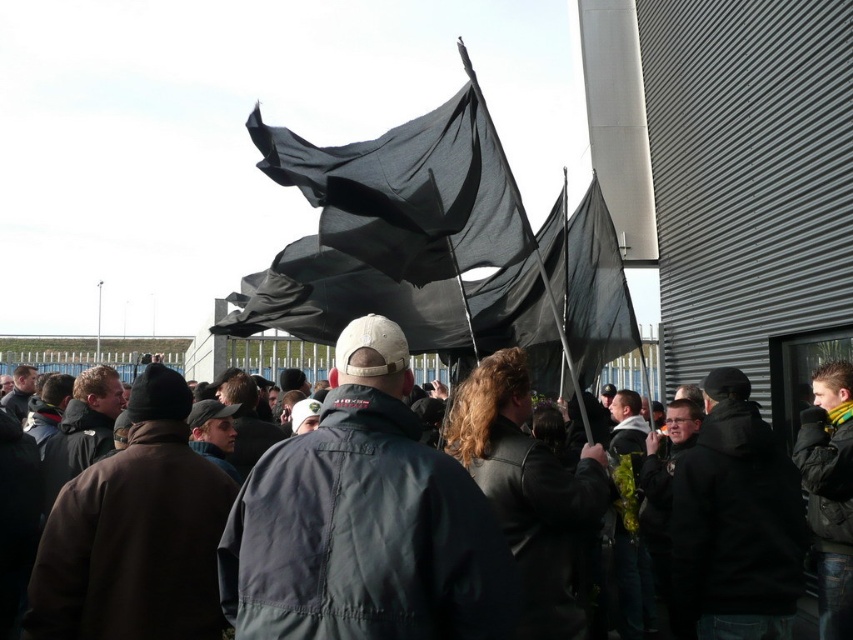
Who is more distant from viewer, (x=402, y=476) or (x=828, y=346)?

The point (x=828, y=346) is behind.

Does point (509, 598) come in front of point (784, 564)?

Yes, it is.

You are a GUI agent. You are given a task and a screenshot of the screen. Output one action in this format:
    pyautogui.click(x=<x>, y=<y>)
    Task: Click on the dark gray jacket at center
    This screenshot has height=640, width=853.
    Given the screenshot: What is the action you would take?
    pyautogui.click(x=364, y=520)

The width and height of the screenshot is (853, 640). I want to click on dark gray jacket at center, so click(x=364, y=520).

Is point (321, 461) farther from camera compared to point (451, 157)?

No, (321, 461) is in front of (451, 157).

Locate an element on the screen. dark gray jacket at center is located at coordinates tap(364, 520).

Does point (448, 246) come farther from viewer compared to point (798, 340)?

No, it is in front of (798, 340).

Who is more distant from viewer, (347, 147) or (813, 342)?

Point (813, 342)

Describe the element at coordinates (409, 192) in the screenshot. This screenshot has width=853, height=640. I see `black fabric flag at center` at that location.

Where is `black fabric flag at center`? black fabric flag at center is located at coordinates pyautogui.click(x=409, y=192).